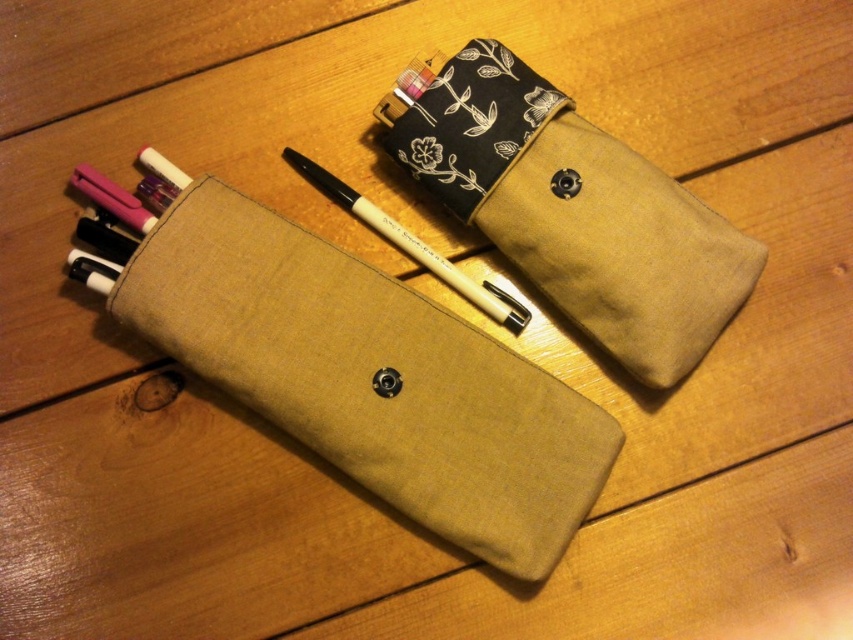
In the scene shown: You have two canvas pouches on a wooden table. The canvas pouch at center and the canvas pouch at upper center. You need to place a large set of art supplies into one of them. Which canvas pouch should you choose?

The canvas pouch at center is bigger than the canvas pouch at upper center, so you should choose the canvas pouch at center to place the large set of art supplies.

You are organizing a stationery set and need to stack the canvas pouch at center and the canvas pouch at upper center vertically. Which one should you place at the bottom to ensure stability?

Answer: The canvas pouch at center should be placed at the bottom because it is taller than the canvas pouch at upper center, providing a more stable base for the stack.